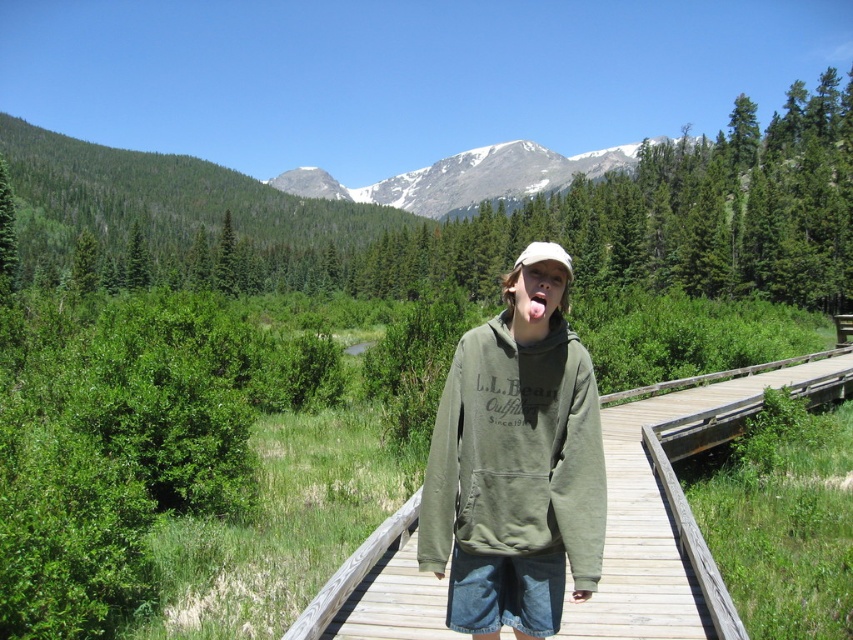
Which is below, olive green hoodie at center or snowy granite mountain at upper center?

olive green hoodie at center is lower down.

The image size is (853, 640). Describe the element at coordinates (515, 452) in the screenshot. I see `olive green hoodie at center` at that location.

Locate an element on the screen. The height and width of the screenshot is (640, 853). olive green hoodie at center is located at coordinates (515, 452).

Identify the location of wooden at center. (680, 496).

Looking at this image, does wooden at center have a lesser width compared to snowy granite mountain at upper center?

Yes.

Locate an element on the screen. This screenshot has height=640, width=853. wooden at center is located at coordinates (680, 496).

Is wooden at center smaller than olive green hoodie at center?

No, wooden at center is not smaller than olive green hoodie at center.

Based on the photo, which of these two, wooden at center or olive green hoodie at center, stands taller?

wooden at center

Which is behind, point (679, 387) or point (476, 348)?

Positioned behind is point (679, 387).

Locate an element on the screen. wooden at center is located at coordinates (680, 496).